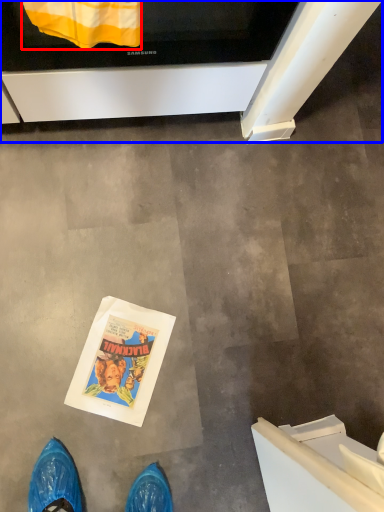
Question: Which of the following is the farthest to the observer, blanket (highlighted by a red box) or oven (highlighted by a blue box)?

Choices:
 (A) blanket
 (B) oven

Answer: (B)